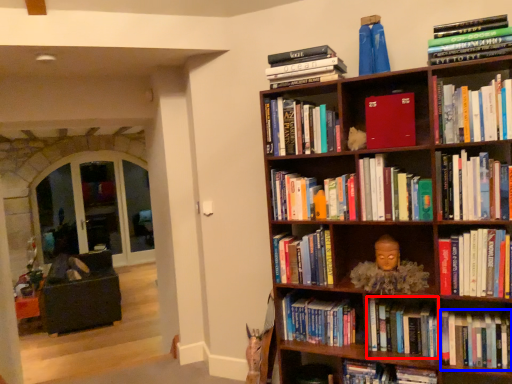
Question: Which of the following is the closest to the observer, book (highlighted by a red box) or book (highlighted by a blue box)?

Choices:
 (A) book
 (B) book

Answer: (B)